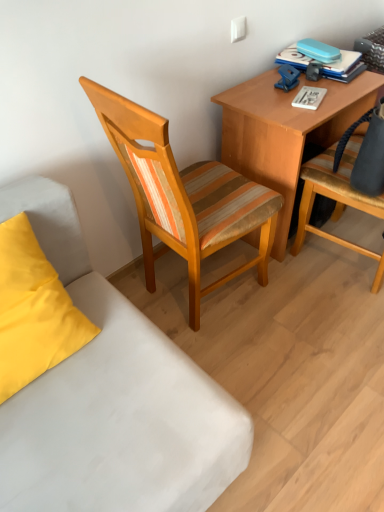
Identify the location of unoccupied region to the right of woodenchair at center, the first chair when ordered from left to right. Image resolution: width=384 pixels, height=512 pixels. pyautogui.click(x=312, y=315).